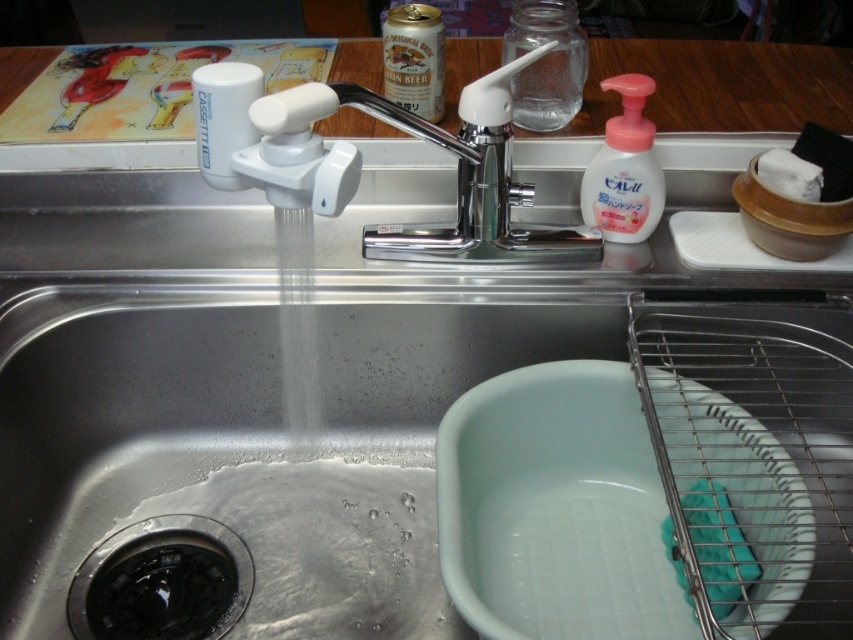
Who is taller, pink plastic soap dispenser at upper right or white matte plate at right?

With more height is pink plastic soap dispenser at upper right.

Based on the photo, is pink plastic soap dispenser at upper right above white matte plate at right?

Answer: Indeed, pink plastic soap dispenser at upper right is positioned over white matte plate at right.

Is point (647, 205) positioned after point (694, 252)?

No, it is in front of (694, 252).

Where is `pink plastic soap dispenser at upper right`? The image size is (853, 640). pink plastic soap dispenser at upper right is located at coordinates [624, 168].

Is the position of pink plastic soap dispenser at upper right less distant than that of white foam soap at right?

No, pink plastic soap dispenser at upper right is behind white foam soap at right.

From the picture: Who is more distant from viewer, (643,170) or (776,156)?

Point (643,170)

Where is `pink plastic soap dispenser at upper right`? pink plastic soap dispenser at upper right is located at coordinates (624, 168).

Is transparent glass jar at upper center closer to the viewer compared to white matte plate at right?

No, transparent glass jar at upper center is behind white matte plate at right.

Does transparent glass jar at upper center have a greater width compared to white matte plate at right?

No, transparent glass jar at upper center is not wider than white matte plate at right.

What are the coordinates of `transparent glass jar at upper center` in the screenshot? It's located at (544, 61).

Locate an element on the screen. Image resolution: width=853 pixels, height=640 pixels. transparent glass jar at upper center is located at coordinates 544,61.